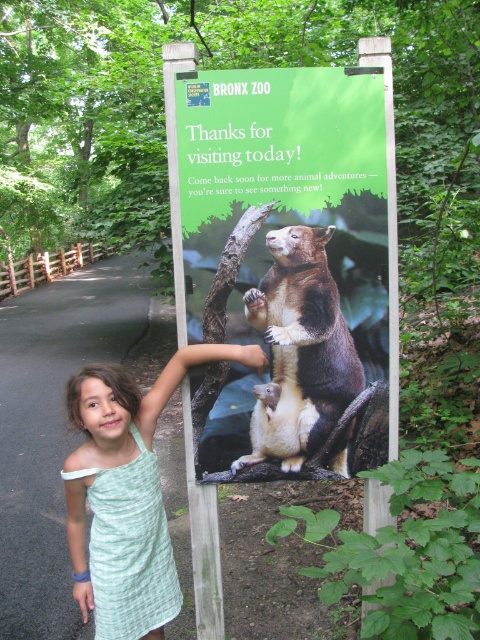
Question: Is brown furry bear at center below green woven dress at center?

Choices:
 (A) yes
 (B) no

Answer: (B)

Question: Is green paper sign at center to the left of green woven dress at center from the viewer's perspective?

Choices:
 (A) yes
 (B) no

Answer: (B)

Question: Which of the following is the farthest from the observer?

Choices:
 (A) green paper sign at center
 (B) brown furry bear at center

Answer: (B)

Question: Which object appears farthest from the camera in this image?

Choices:
 (A) green woven dress at center
 (B) brown furry bear at center
 (C) green paper sign at center

Answer: (B)

Question: Is brown furry bear at center smaller than green woven dress at center?

Choices:
 (A) yes
 (B) no

Answer: (A)

Question: Estimate the real-world distances between objects in this image. Which object is farther from the green paper sign at center?

Choices:
 (A) green woven dress at center
 (B) brown furry bear at center

Answer: (A)